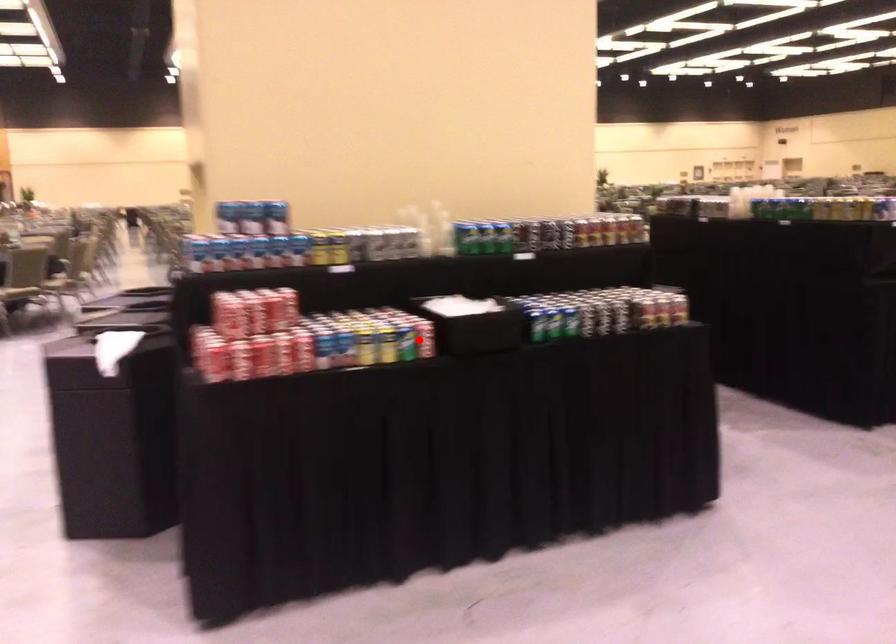
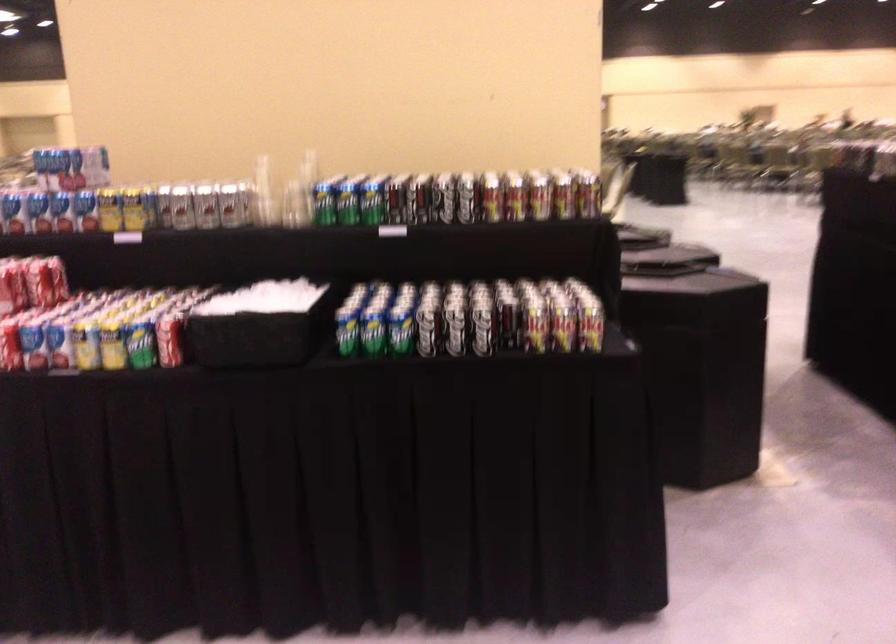
Question: I am providing you with two images of the same scene from different viewpoints. Image1 has a red point marked. In image2, the corresponding 3D location appears at what relative position? Reply with the corresponding letter.

Choices:
 (A) Closer
 (B) Farther

Answer: (A)